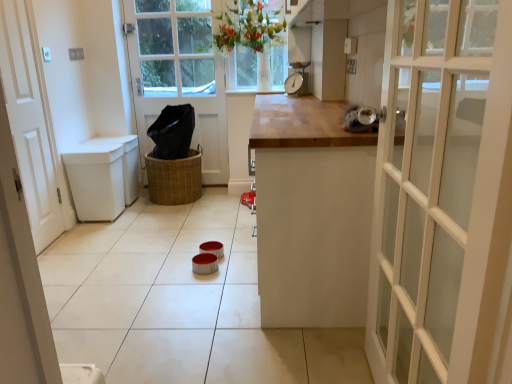
Question: Is the position of white wooden door at center, which ranks as the 1th door in back-to-front order, more distant than that of white matte door at left, the 2th door in the back-to-front sequence?

Choices:
 (A) yes
 (B) no

Answer: (A)

Question: Is white wooden door at center, arranged as the second door when viewed from the left, looking in the opposite direction of white matte door at left, which appears as the first door when viewed from the front?

Choices:
 (A) yes
 (B) no

Answer: (B)

Question: Does white wooden door at center, the 1th door from the right, have a greater height compared to white matte door at left, arranged as the first door when viewed from the left?

Choices:
 (A) yes
 (B) no

Answer: (A)

Question: From a real-world perspective, is white wooden door at center, which ranks as the 1th door in back-to-front order, under white matte door at left, arranged as the first door when viewed from the left?

Choices:
 (A) no
 (B) yes

Answer: (A)

Question: Is white wooden door at center, the 2th door positioned from the front, thinner than white matte door at left, the second door from the right?

Choices:
 (A) yes
 (B) no

Answer: (B)

Question: Considering the relative positions of white wooden door at center, arranged as the second door when viewed from the left, and white matte door at left, the 2th door in the back-to-front sequence, in the image provided, is white wooden door at center, arranged as the second door when viewed from the left, to the left of white matte door at left, the 2th door in the back-to-front sequence, from the viewer's perspective?

Choices:
 (A) no
 (B) yes

Answer: (A)

Question: Does metallic scale at center contain white wooden door at center, the 2th door positioned from the front?

Choices:
 (A) no
 (B) yes

Answer: (A)

Question: Does metallic scale at center have a smaller size compared to white wooden door at center, the 2th door positioned from the front?

Choices:
 (A) no
 (B) yes

Answer: (B)

Question: Is metallic scale at center at the right side of white wooden door at center, the 1th door from the right?

Choices:
 (A) yes
 (B) no

Answer: (A)

Question: From the image's perspective, is metallic scale at center located above white wooden door at center, the 1th door from the right?

Choices:
 (A) no
 (B) yes

Answer: (B)

Question: Considering the relative sizes of metallic scale at center and white wooden door at center, which ranks as the 1th door in back-to-front order, in the image provided, is metallic scale at center shorter than white wooden door at center, which ranks as the 1th door in back-to-front order,?

Choices:
 (A) yes
 (B) no

Answer: (A)

Question: Does metallic scale at center appear on the left side of white wooden door at center, which ranks as the 1th door in back-to-front order?

Choices:
 (A) yes
 (B) no

Answer: (B)

Question: From the image's perspective, is braided wicker basket at center beneath white matte door at left, the 2th door in the back-to-front sequence?

Choices:
 (A) no
 (B) yes

Answer: (B)